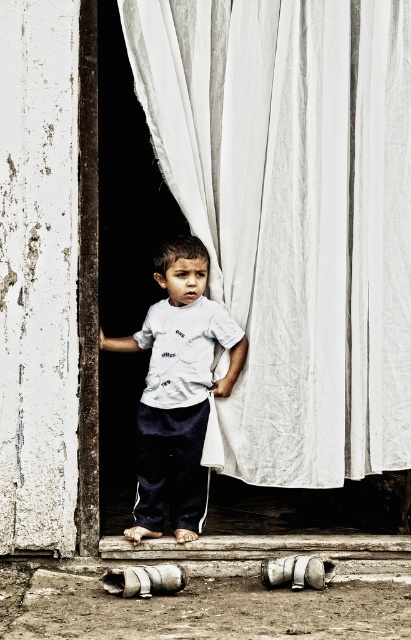
Question: Among these objects, which one is farthest from the camera?

Choices:
 (A) white cotton shirt at center
 (B) white fabric curtain at center

Answer: (A)

Question: Among these objects, which one is farthest from the camera?

Choices:
 (A) white cotton shirt at center
 (B) white fabric curtain at center

Answer: (A)

Question: Does white fabric curtain at center have a smaller size compared to white cotton shirt at center?

Choices:
 (A) no
 (B) yes

Answer: (A)

Question: Can you confirm if white fabric curtain at center is positioned to the left of white cotton shirt at center?

Choices:
 (A) no
 (B) yes

Answer: (A)

Question: Is white fabric curtain at center above white cotton shirt at center?

Choices:
 (A) yes
 (B) no

Answer: (A)

Question: Which object appears closest to the camera in this image?

Choices:
 (A) white cotton shirt at center
 (B) white fabric curtain at center

Answer: (B)